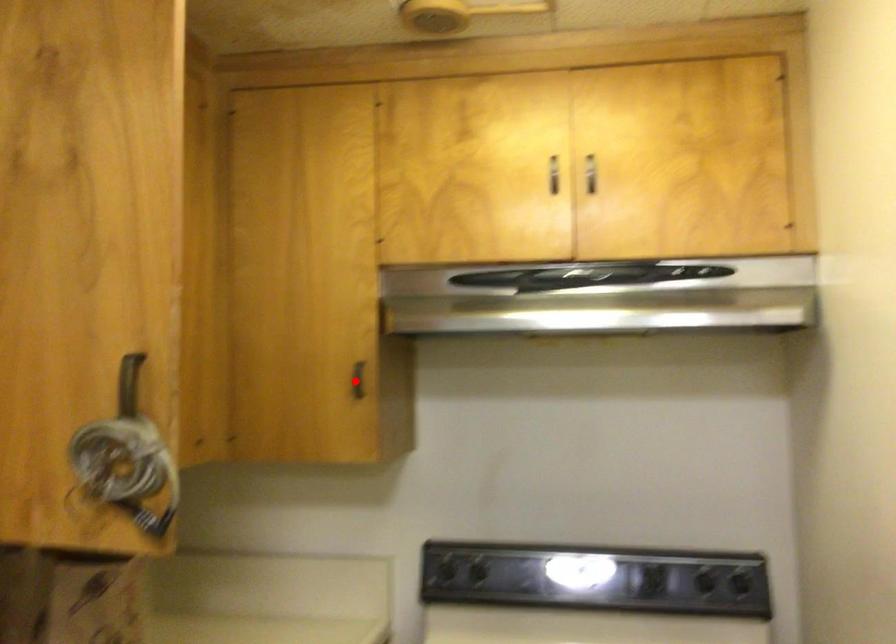
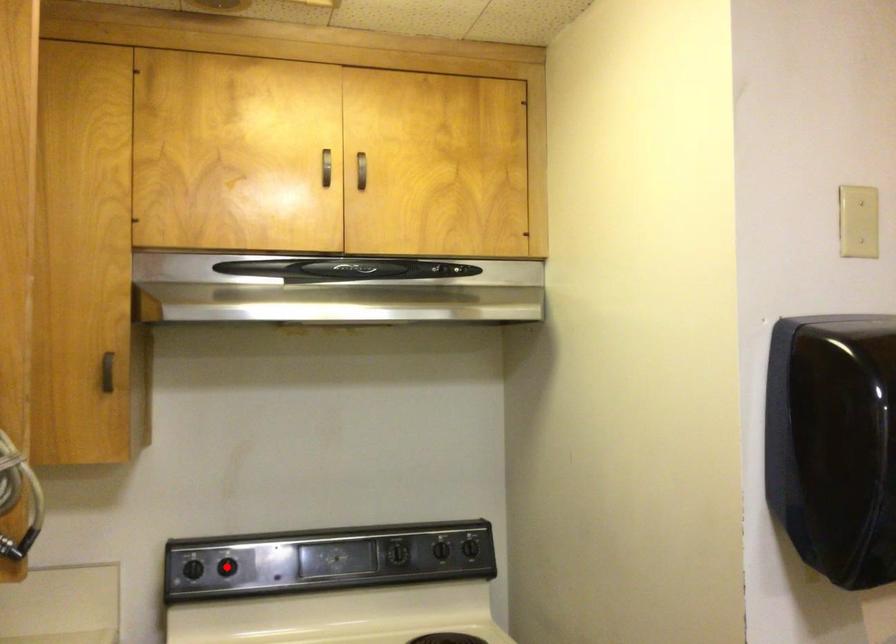
I am providing you with two images of the same scene from different viewpoints. A red point is marked on the first image and another point is marked on the second image. Are the points marked in image1 and image2 representing the same 3D position?

No